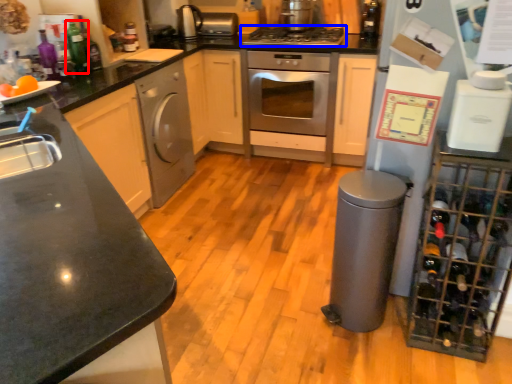
Question: Which point is closer to the camera, bottle (highlighted by a red box) or gas stove (highlighted by a blue box)?

Choices:
 (A) bottle
 (B) gas stove

Answer: (A)